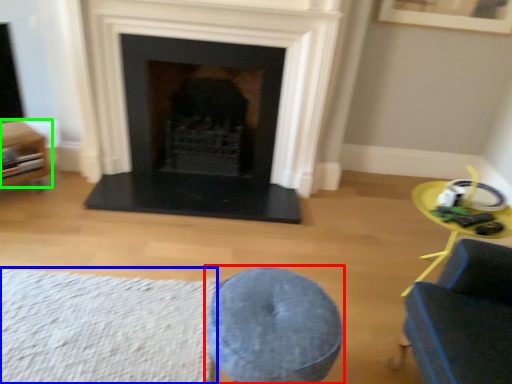
Question: Estimate the real-world distances between objects in this image. Which object is closer to bar stool (highlighted by a red box), plain (highlighted by a blue box) or furniture (highlighted by a green box)?

Choices:
 (A) plain
 (B) furniture

Answer: (A)